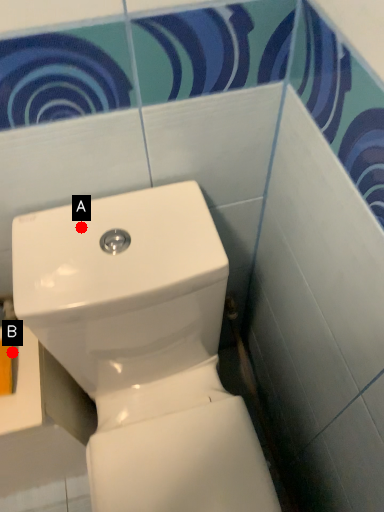
Question: Two points are circled on the image, labeled by A and B beside each circle. Which point is further to the camera?

Choices:
 (A) A is further
 (B) B is further

Answer: (B)